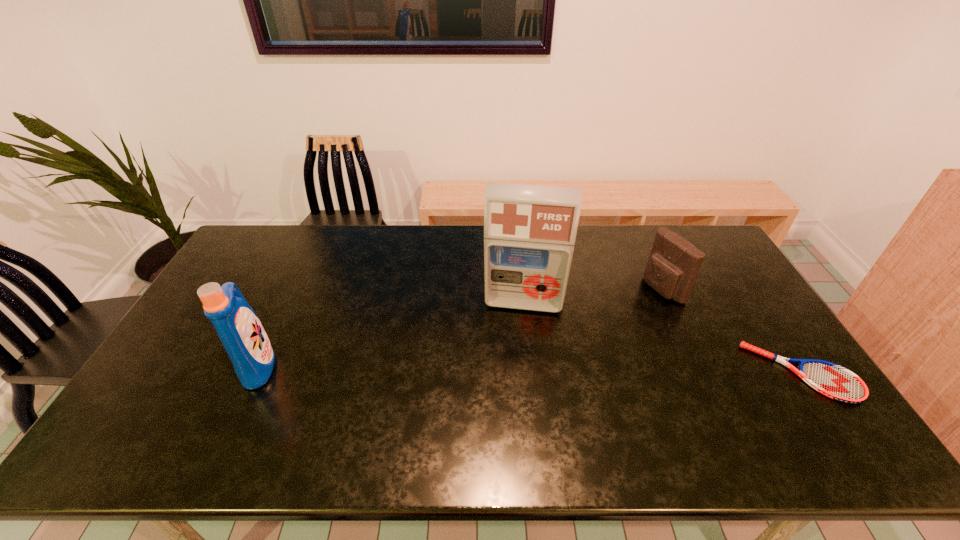
Where is `free space between the third object from left to right and the tennis racket`? This screenshot has width=960, height=540. free space between the third object from left to right and the tennis racket is located at coordinates (732, 331).

The width and height of the screenshot is (960, 540). I want to click on unoccupied area between the rightmost object and the third shortest object, so click(530, 369).

You are a GUI agent. You are given a task and a screenshot of the screen. Output one action in this format:
    pyautogui.click(x=<x>, y=<y>)
    Task: Click on the unoccupied position between the rightmost object and the third object from right to left
    
    Given the screenshot: What is the action you would take?
    pyautogui.click(x=662, y=338)

Locate an element on the screen. The image size is (960, 540). vacant space that is in between the second shortest object and the tennis racket is located at coordinates (732, 331).

Locate an element on the screen. Image resolution: width=960 pixels, height=540 pixels. unoccupied area between the tennis racket and the third object from right to left is located at coordinates point(662,338).

The width and height of the screenshot is (960, 540). Identify the location of object that is the second closest to the detergent. (673, 265).

Select which object is the second closest to the leftmost object. Please provide its 2D coordinates. Your answer should be formatted as a tuple, i.e. [(x, y)], where the tuple contains the x and y coordinates of a point satisfying the conditions above.

[(673, 265)]